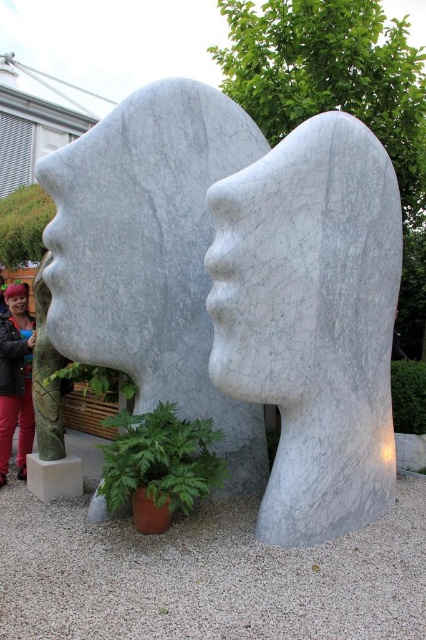
Does white marble sculpture at center appear over blonde hair at center?

No.

Is point (62, 310) farther from viewer compared to point (20, 298)?

That is False.

Describe the element at coordinates (239, 289) in the screenshot. The image size is (426, 640). I see `white marble sculpture at center` at that location.

This screenshot has width=426, height=640. What are the coordinates of `white marble sculpture at center` in the screenshot? It's located at (239, 289).

Who is more distant from viewer, [57,246] or [17,298]?

Positioned behind is point [17,298].

Is white marble sculpture at center to the left of matte black jacket at lower left from the viewer's perspective?

Incorrect, white marble sculpture at center is not on the left side of matte black jacket at lower left.

Between point (222, 429) and point (20, 368), which one is positioned behind?

The point (20, 368) is more distant.

Locate an element on the screen. Image resolution: width=426 pixels, height=640 pixels. white marble sculpture at center is located at coordinates (239, 289).

From the picture: Who is positioned more to the right, matte black jacket at lower left or blonde hair at center?

matte black jacket at lower left is more to the right.

Between matte black jacket at lower left and blonde hair at center, which one is positioned higher?

blonde hair at center is higher up.

Is point (0, 403) positioned after point (14, 284)?

That is False.

The height and width of the screenshot is (640, 426). What are the coordinates of `matte black jacket at lower left` in the screenshot? It's located at (16, 380).